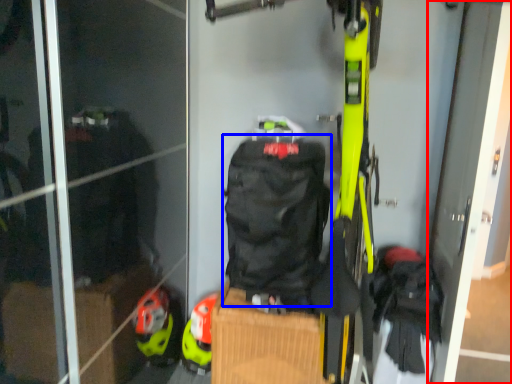
Question: Among these objects, which one is farthest to the camera, screen door (highlighted by a red box) or backpack (highlighted by a blue box)?

Choices:
 (A) screen door
 (B) backpack

Answer: (B)